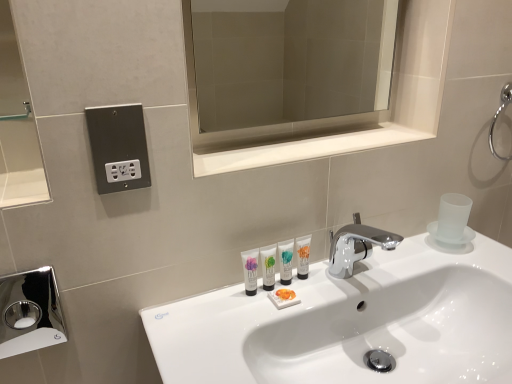
Question: Is metallic outlet at upper left inside white glossy tube at center, which is counted as the second mouthwash, starting from the right?

Choices:
 (A) yes
 (B) no

Answer: (B)

Question: From a real-world perspective, is white glossy tube at center, which is counted as the second mouthwash, starting from the right, located higher than metallic outlet at upper left?

Choices:
 (A) no
 (B) yes

Answer: (A)

Question: Can you confirm if white glossy tube at center, which is counted as the second mouthwash, starting from the right, is thinner than metallic outlet at upper left?

Choices:
 (A) no
 (B) yes

Answer: (A)

Question: Is white glossy tube at center, the 3th mouthwash in the left-to-right sequence, smaller than metallic outlet at upper left?

Choices:
 (A) no
 (B) yes

Answer: (B)

Question: Considering the relative positions of white glossy tube at center, the 3th mouthwash in the left-to-right sequence, and metallic outlet at upper left in the image provided, is white glossy tube at center, the 3th mouthwash in the left-to-right sequence, in front of metallic outlet at upper left?

Choices:
 (A) yes
 (B) no

Answer: (B)

Question: Is white glossy tube at center, which is counted as the second mouthwash, starting from the right, positioned with its back to metallic outlet at upper left?

Choices:
 (A) no
 (B) yes

Answer: (A)

Question: Is white glossy tube at center, which is counted as the second mouthwash, starting from the right, closer to camera compared to white glossy tube at center, acting as the 4th mouthwash starting from the right?

Choices:
 (A) yes
 (B) no

Answer: (B)

Question: Is white glossy tube at center, the 3th mouthwash in the left-to-right sequence, to the left of white glossy tube at center, the first mouthwash in the left-to-right sequence, from the viewer's perspective?

Choices:
 (A) no
 (B) yes

Answer: (A)

Question: Is white glossy tube at center, which is counted as the second mouthwash, starting from the right, completely or partially outside of white glossy tube at center, acting as the 4th mouthwash starting from the right?

Choices:
 (A) no
 (B) yes

Answer: (B)

Question: Considering the relative sizes of white glossy tube at center, the 3th mouthwash in the left-to-right sequence, and white glossy tube at center, the first mouthwash in the left-to-right sequence, in the image provided, is white glossy tube at center, the 3th mouthwash in the left-to-right sequence, smaller than white glossy tube at center, the first mouthwash in the left-to-right sequence,?

Choices:
 (A) no
 (B) yes

Answer: (B)

Question: From the image's perspective, does white glossy tube at center, the 3th mouthwash in the left-to-right sequence, appear lower than white glossy tube at center, the first mouthwash in the left-to-right sequence?

Choices:
 (A) no
 (B) yes

Answer: (A)

Question: Is the position of white glossy tube at center, the 3th mouthwash in the left-to-right sequence, more distant than that of white glossy tube at center, the first mouthwash in the left-to-right sequence?

Choices:
 (A) yes
 (B) no

Answer: (A)

Question: Is white glossy tube at center, acting as the 4th mouthwash starting from the right, facing away from white glossy sink at center?

Choices:
 (A) no
 (B) yes

Answer: (A)